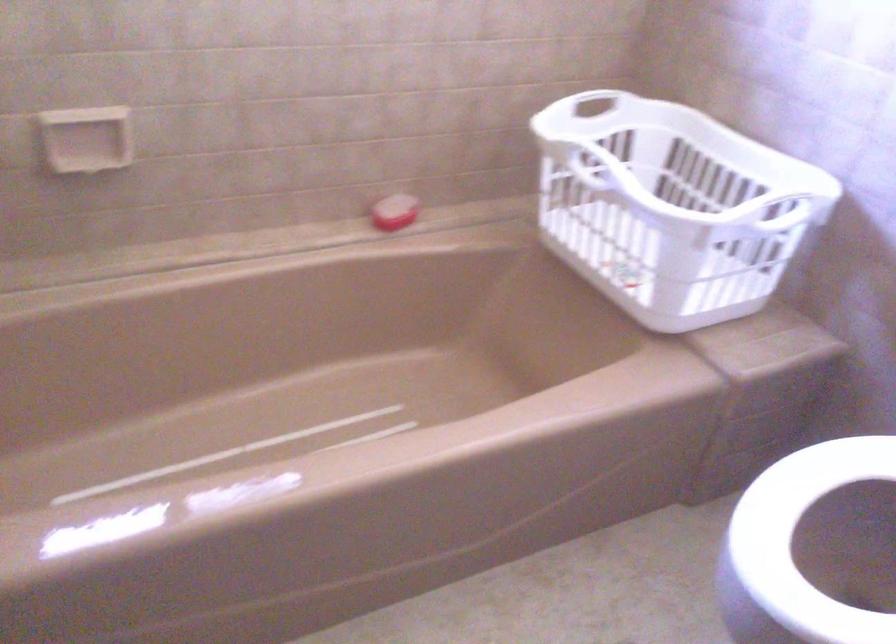
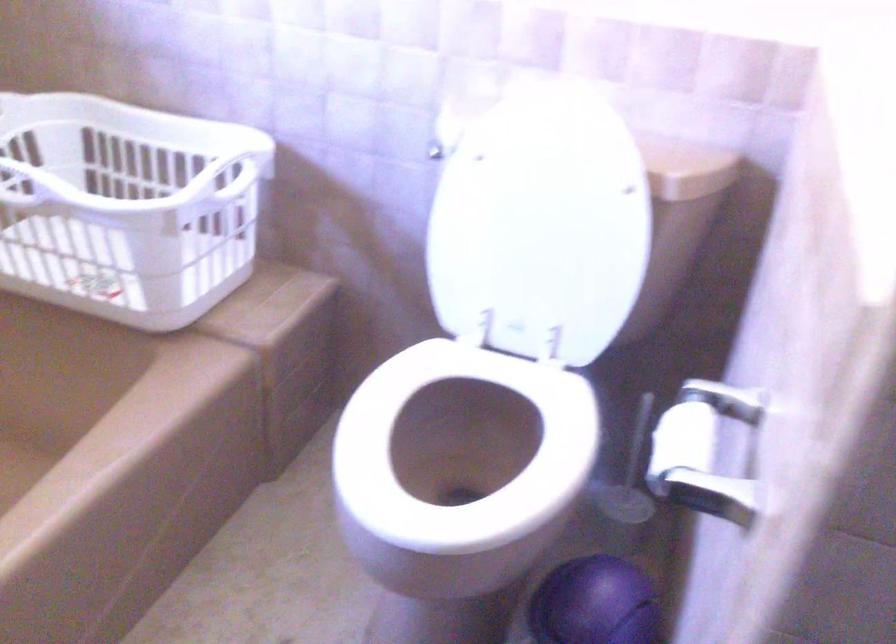
Question: How did the camera likely rotate?

Choices:
 (A) Left
 (B) Right
 (C) Up
 (D) Down

Answer: (B)